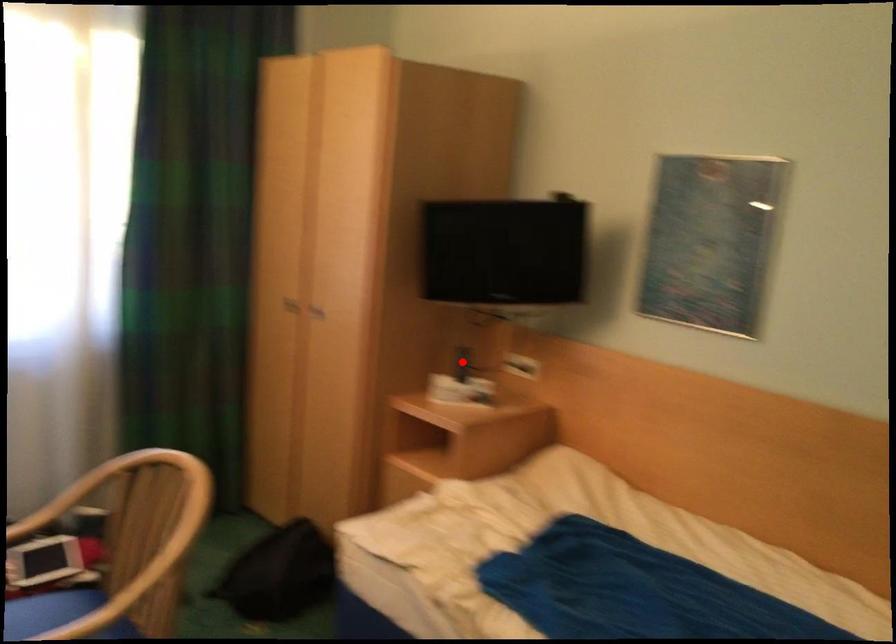
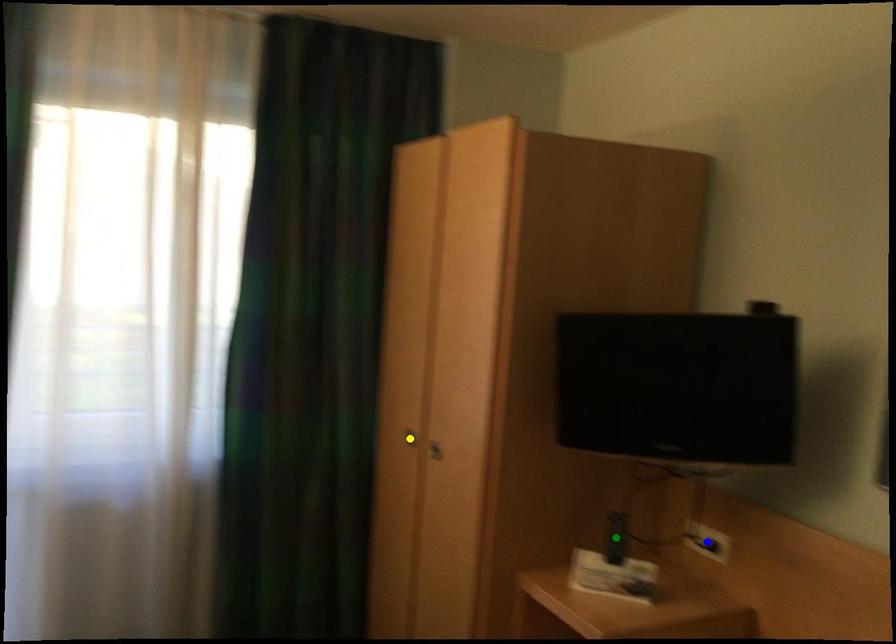
Question: I am providing you with two images of the same scene from different viewpoints. A red point is marked on the first image. You are given multiple points on the second image. Which mark in image 2 goes with the point in image 1?

Choices:
 (A) green point
 (B) blue point
 (C) yellow point

Answer: (A)